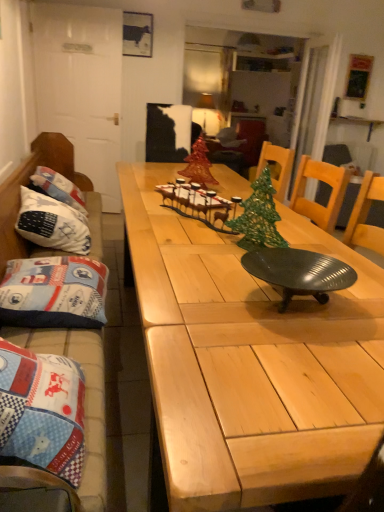
Where is `space that is in front of metallic dark green tray at center`? The image size is (384, 512). space that is in front of metallic dark green tray at center is located at coordinates (298, 356).